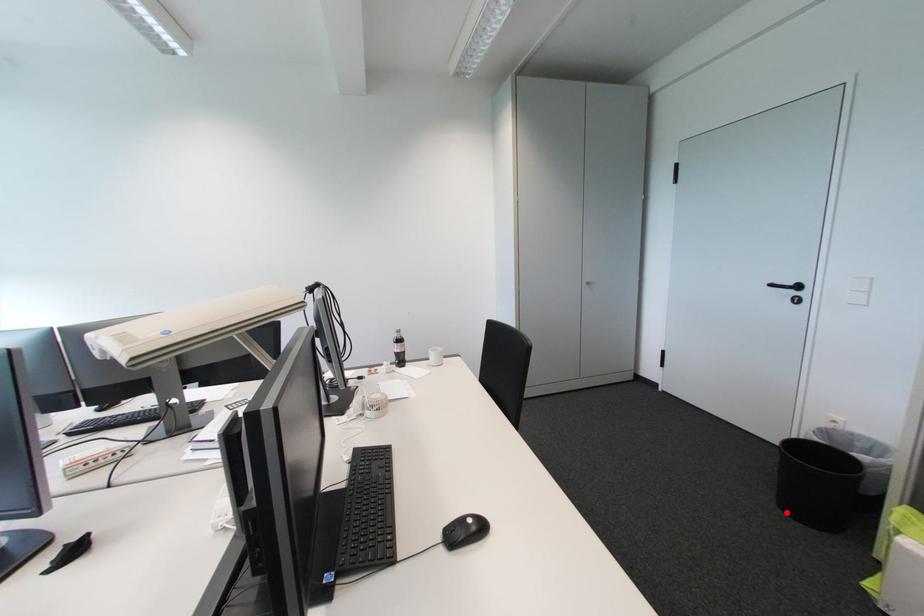
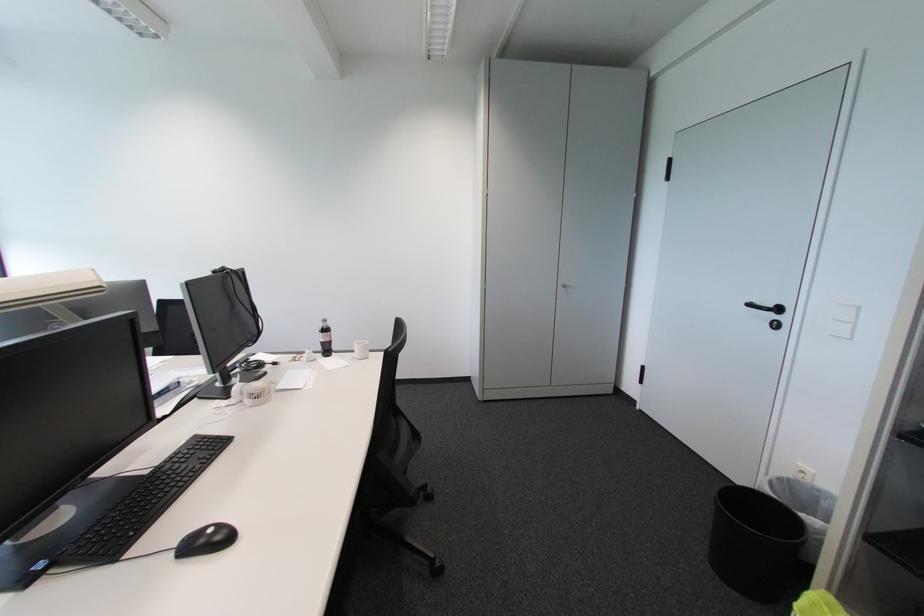
Question: I am providing you with two images of the same scene from different viewpoints. A red point is shown in image1. For the corresponding object point in image2, is it positioned nearer or farther from the camera?

Choices:
 (A) Nearer
 (B) Farther

Answer: (A)